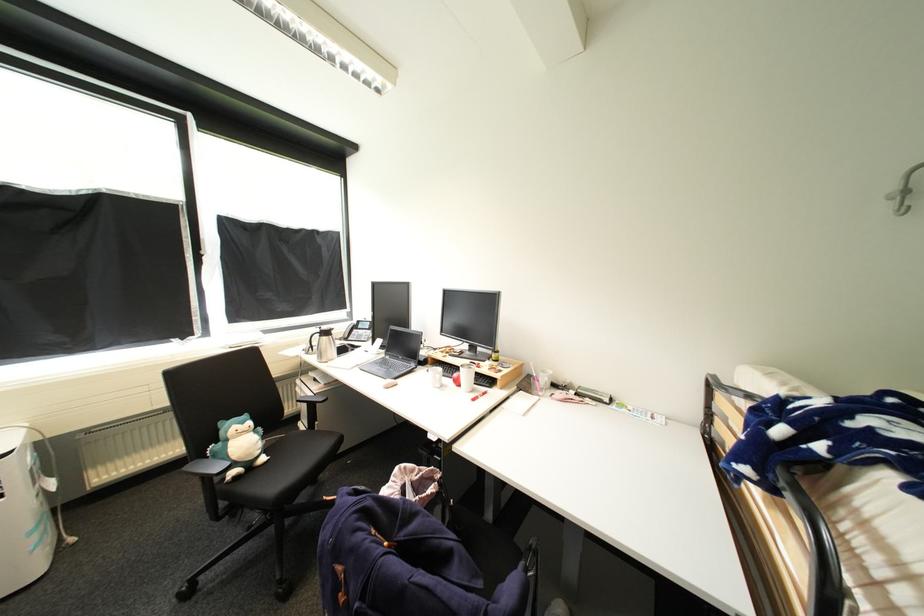
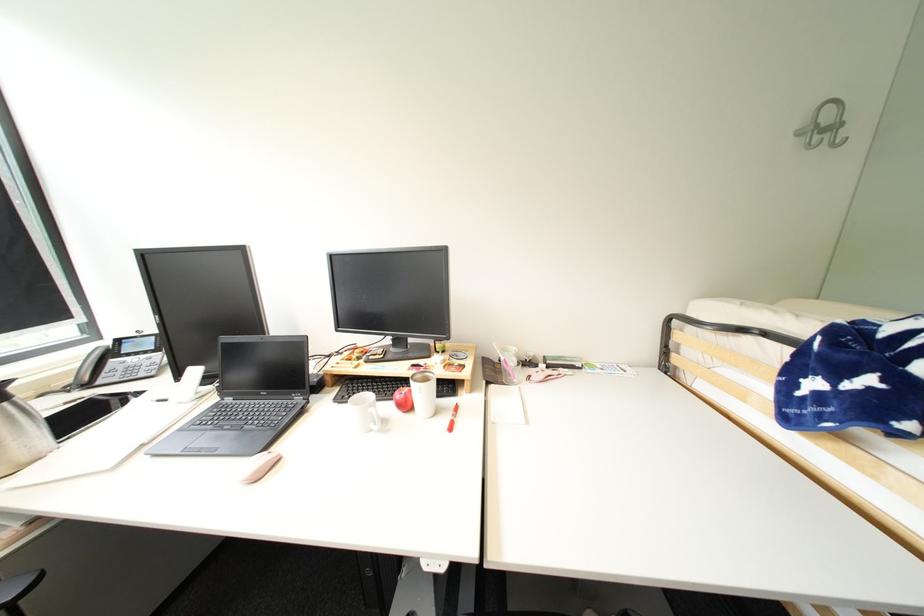
Where in the second image is the point corresponding to point (490, 390) from the first image?

(456, 402)